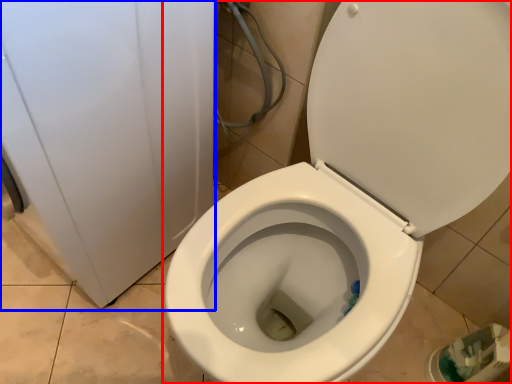
Question: Which point is closer to the camera, toilet (highlighted by a red box) or porcelain (highlighted by a blue box)?

Choices:
 (A) toilet
 (B) porcelain

Answer: (A)